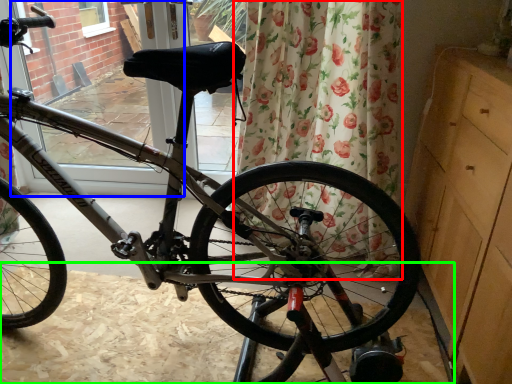
Question: Estimate the real-world distances between objects in this image. Which object is closer to curtain (highlighted by a red box), screen door (highlighted by a blue box) or dirt track (highlighted by a green box)?

Choices:
 (A) screen door
 (B) dirt track

Answer: (B)